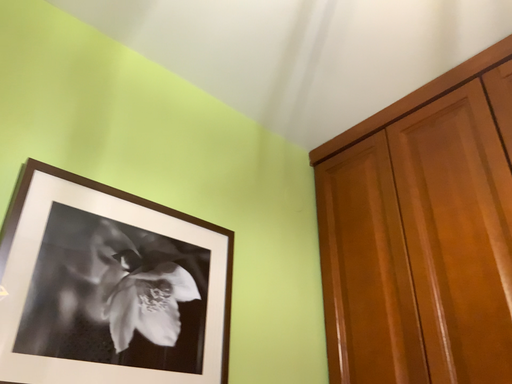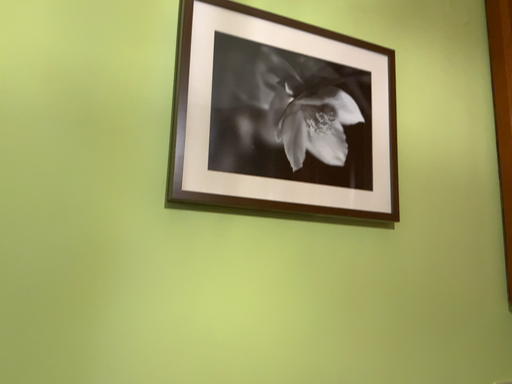
Question: Which way did the camera rotate in the video?

Choices:
 (A) rotated right
 (B) rotated left

Answer: (B)